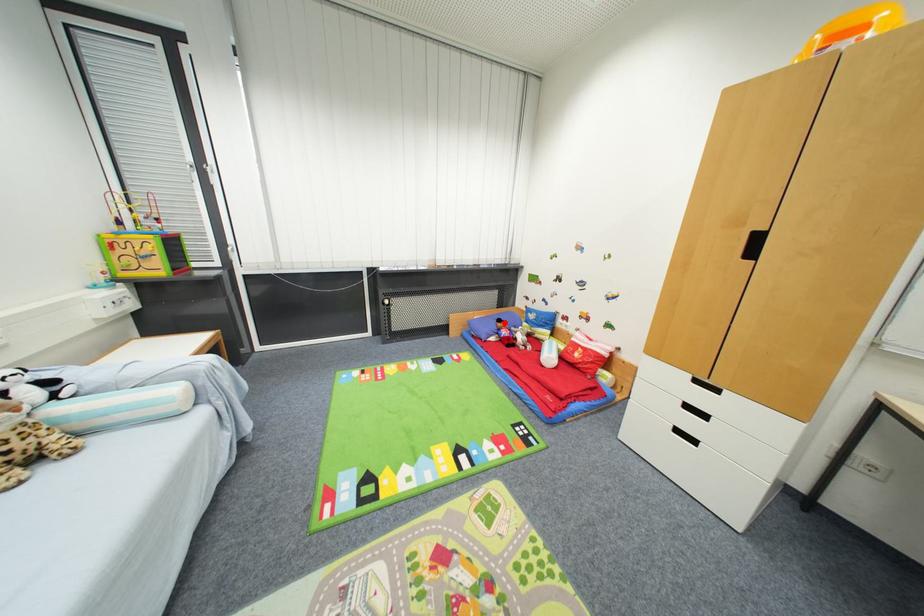
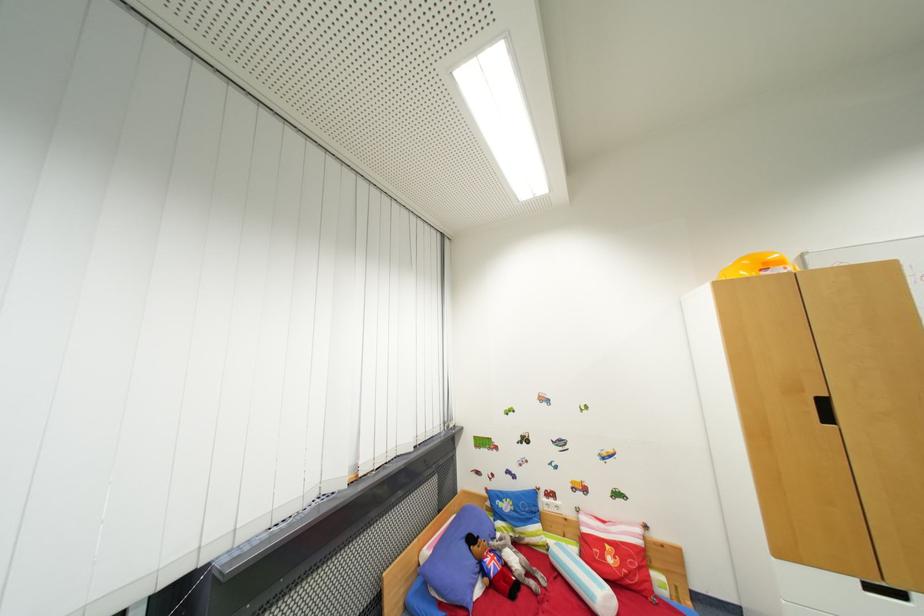
Where in the second image is the point corresponding to the highlighted location from the first image?

(477, 541)